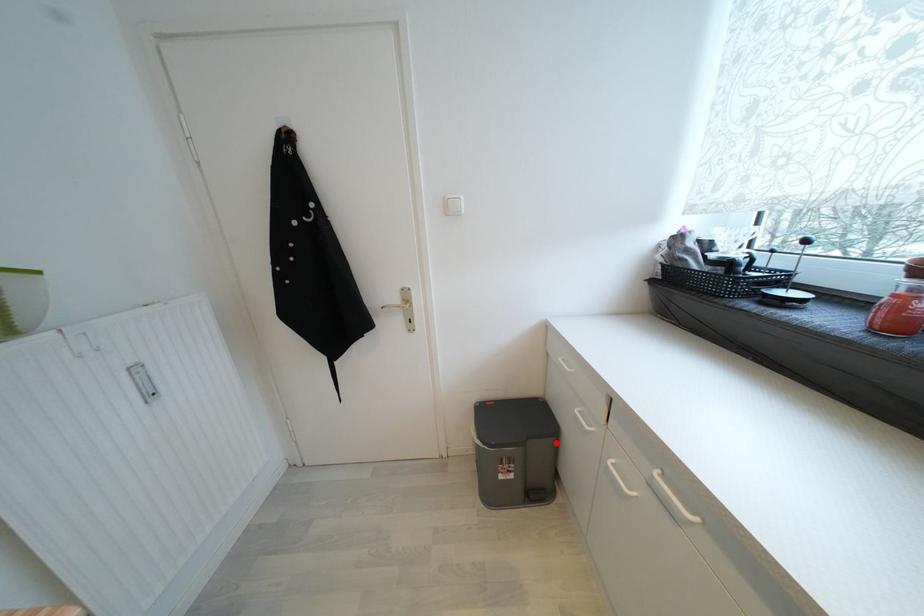
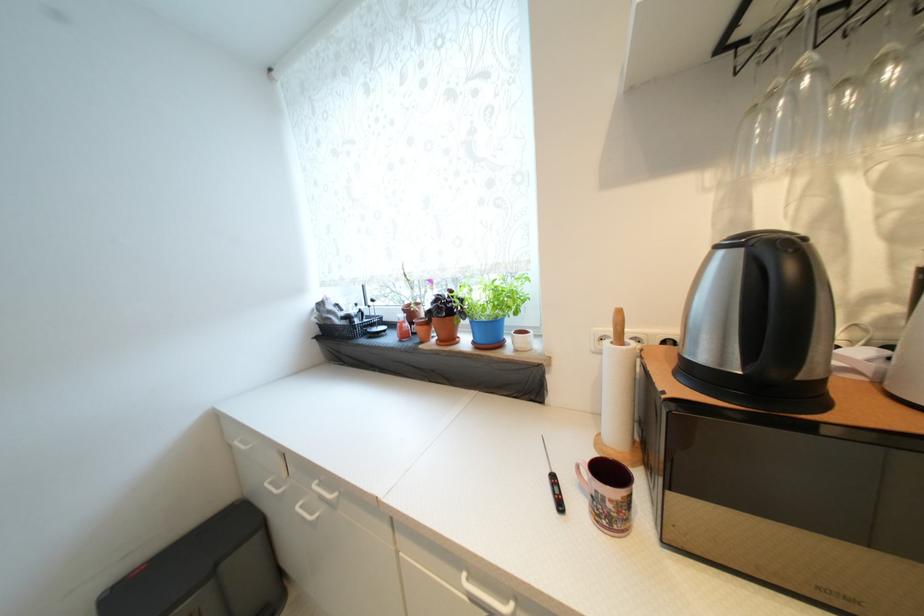
Locate, in the second image, the point that corresponds to the highlighted location in the first image.

(261, 541)